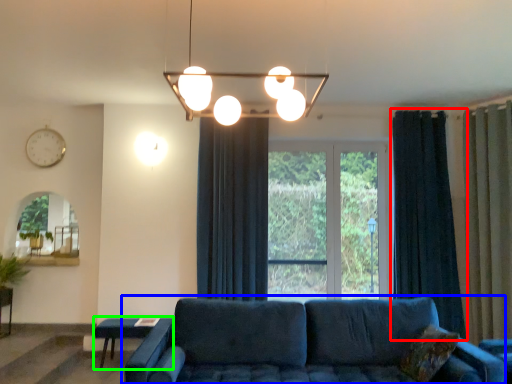
Question: Which object is positioned farthest from curtain (highlighted by a red box)? Select from studio couch (highlighted by a blue box) and table (highlighted by a green box).

Choices:
 (A) studio couch
 (B) table

Answer: (B)